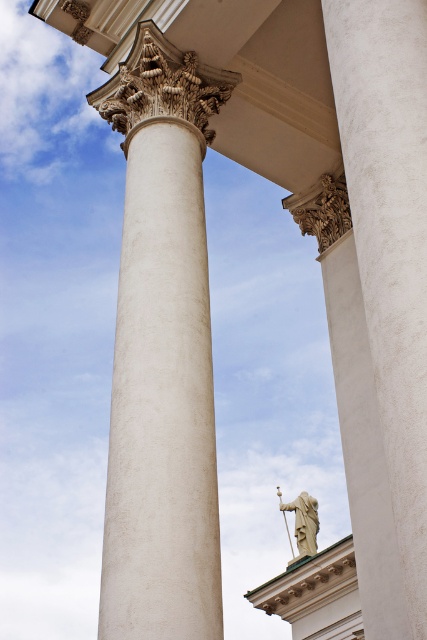
Is point (207, 122) closer to viewer compared to point (312, 500)?

Yes, it is.

Does white smooth column at center have a larger size compared to stone statue at center?

Correct, white smooth column at center is larger in size than stone statue at center.

Who is more distant from viewer, (134,212) or (301,556)?

The point (301,556) is behind.

Image resolution: width=427 pixels, height=640 pixels. Find the location of `white smooth column at center`. white smooth column at center is located at coordinates (161, 355).

The width and height of the screenshot is (427, 640). What do you see at coordinates (161, 355) in the screenshot?
I see `white smooth column at center` at bounding box center [161, 355].

Where is `white smooth column at center`? The height and width of the screenshot is (640, 427). white smooth column at center is located at coordinates (161, 355).

Find the location of a particular element. white smooth column at center is located at coordinates click(161, 355).

Is white marble column at center below stone statue at center?

Incorrect, white marble column at center is not positioned below stone statue at center.

Does point (409, 593) lie behind point (312, 515)?

No, (409, 593) is in front of (312, 515).

Who is more forward, (391, 180) or (280, 502)?

Point (391, 180) is more forward.

Locate an element on the screen. This screenshot has height=640, width=427. white marble column at center is located at coordinates (389, 237).